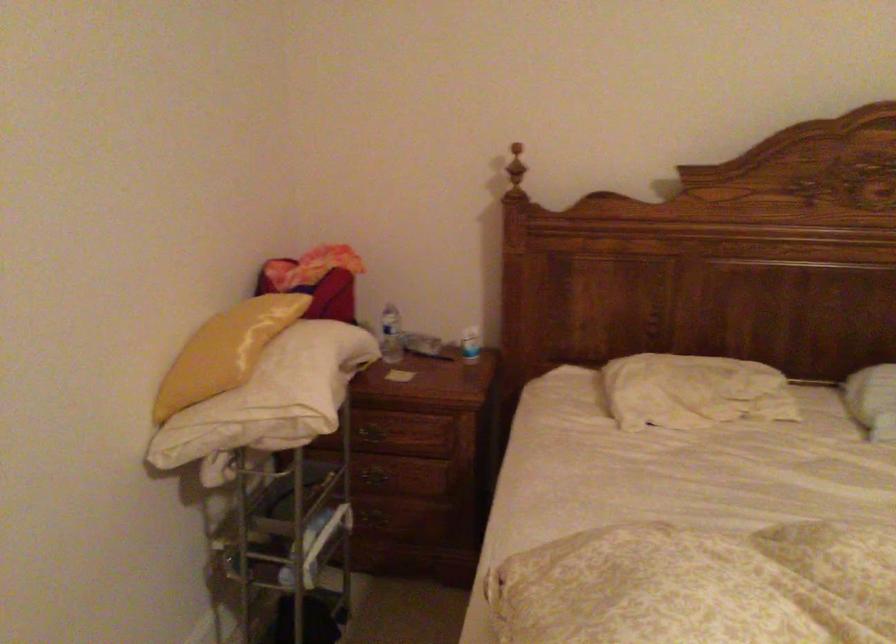
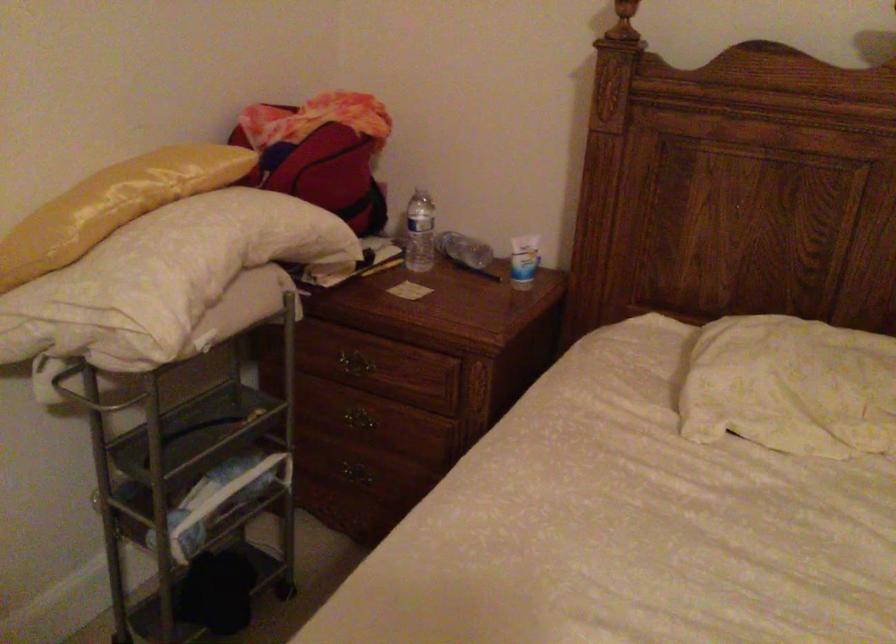
Where in the second image is the point corresponding to [312,384] from the first image?

(164, 278)